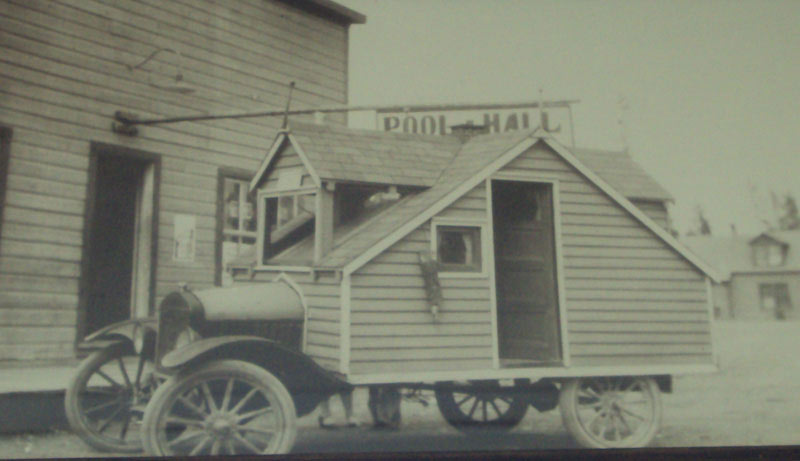
Where is `bracket attaching pole above door`? This screenshot has width=800, height=461. bracket attaching pole above door is located at coordinates (122, 125).